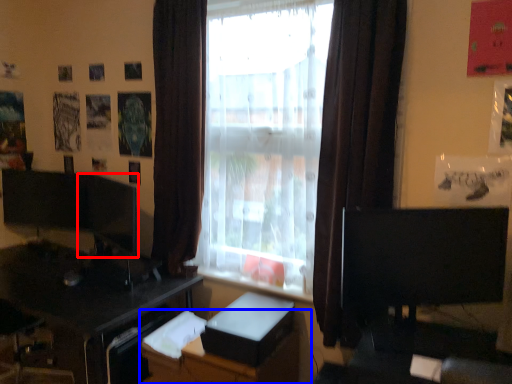
Question: Among these objects, which one is nearest to the camera, computer monitor (highlighted by a red box) or dresser (highlighted by a blue box)?

Choices:
 (A) computer monitor
 (B) dresser

Answer: (B)